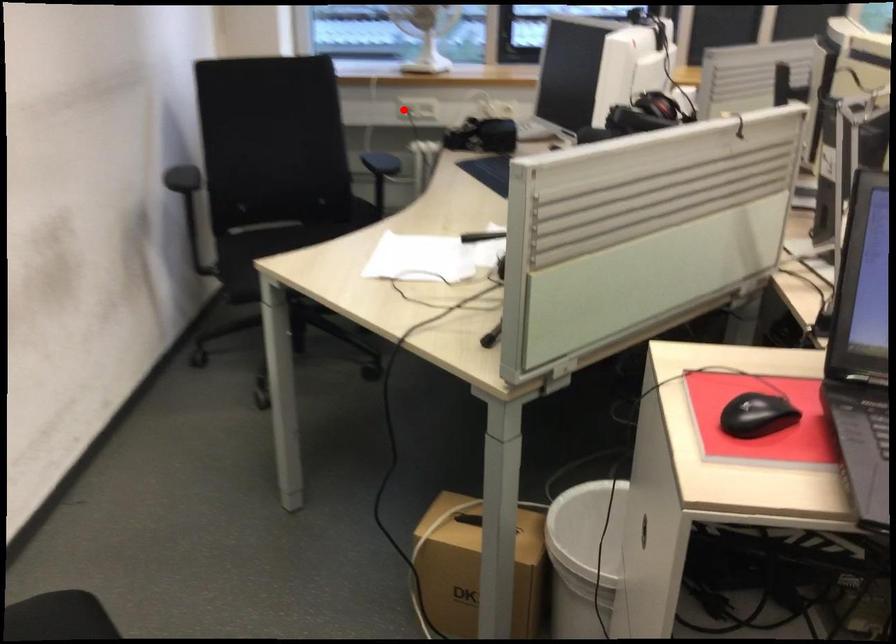
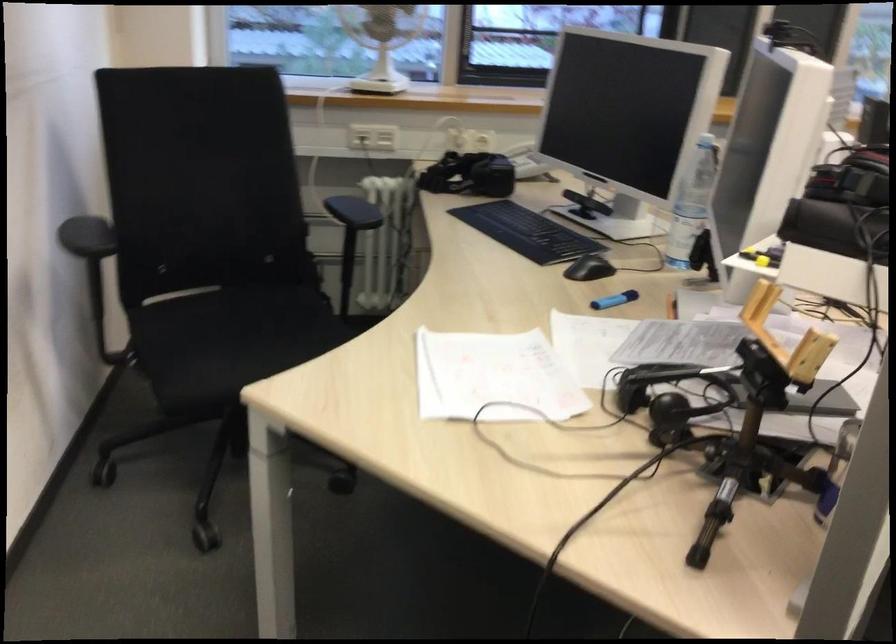
Question: I am providing you with two images of the same scene from different viewpoints. A red point is marked on the first image. At the location where the point appears in image 1, is it still visible in image 2?

Choices:
 (A) Yes
 (B) No

Answer: (A)